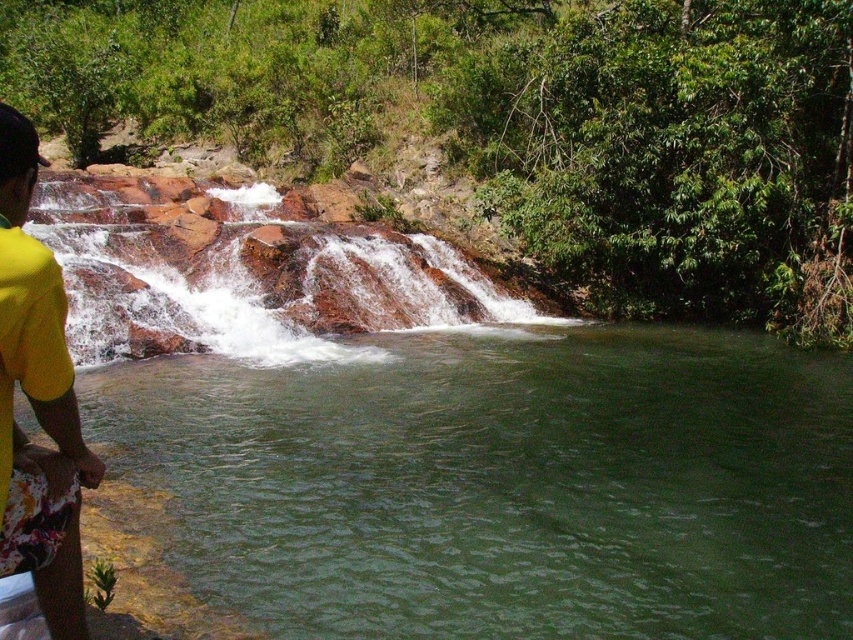
Question: Among these points, which one is nearest to the camera?

Choices:
 (A) (422, 440)
 (B) (279, 333)
 (C) (51, 268)

Answer: (C)

Question: Which of the following is the closest to the observer?

Choices:
 (A) (61, 401)
 (B) (383, 266)

Answer: (A)

Question: Which point is closer to the camera taking this photo?

Choices:
 (A) (128, 548)
 (B) (181, 316)
 (C) (16, 336)

Answer: (C)

Question: Can you confirm if green smooth river at lower left is positioned below rusty rock waterfall at center?

Choices:
 (A) no
 (B) yes

Answer: (B)

Question: Is green smooth river at lower left below rusty rock waterfall at center?

Choices:
 (A) yes
 (B) no

Answer: (A)

Question: Is green smooth river at lower left closer to camera compared to yellow fabric shorts at lower left?

Choices:
 (A) yes
 (B) no

Answer: (B)